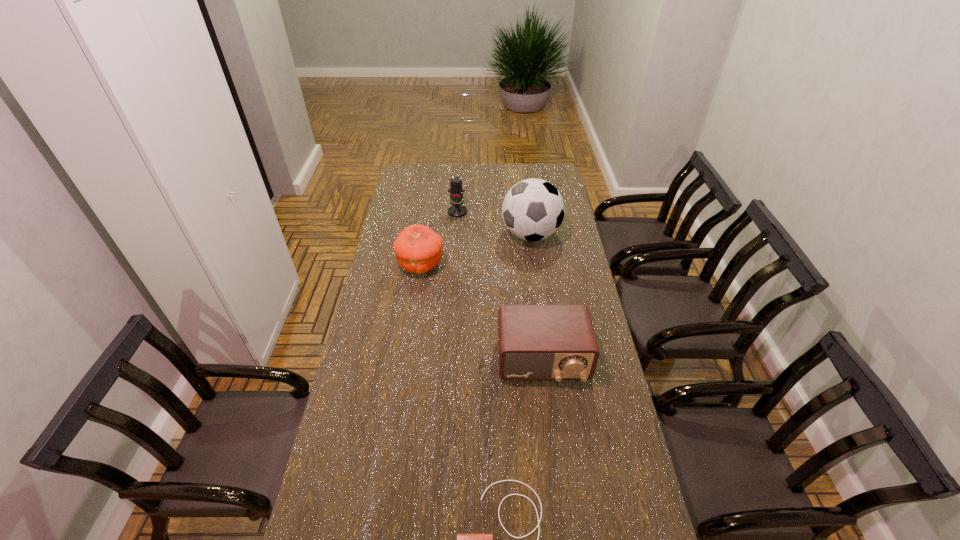
Locate an element on the screen. The image size is (960, 540). vacant region between the taller radio receiver and the microphone is located at coordinates (500, 286).

You are a GUI agent. You are given a task and a screenshot of the screen. Output one action in this format:
    pyautogui.click(x=<x>, y=<y>)
    Task: Click on the free space between the tallest object and the microphone
    The height and width of the screenshot is (540, 960).
    Given the screenshot: What is the action you would take?
    pyautogui.click(x=494, y=223)

Choose which object is the second nearest neighbor to the pumpkin. Please provide its 2D coordinates. Your answer should be formatted as a tuple, i.e. [(x, y)], where the tuple contains the x and y coordinates of a point satisfying the conditions above.

[(533, 209)]

Identify which object is the nearest to the pumpkin. Please provide its 2D coordinates. Your answer should be formatted as a tuple, i.e. [(x, y)], where the tuple contains the x and y coordinates of a point satisfying the conditions above.

[(457, 210)]

You are a GUI agent. You are given a task and a screenshot of the screen. Output one action in this format:
    pyautogui.click(x=<x>, y=<y>)
    Task: Click on the free spot that satisfies the following two spatial constraints: 1. on the main logo of the tallest object; 2. on the front panel of the taller radio receiver
    
    Given the screenshot: What is the action you would take?
    pyautogui.click(x=548, y=360)